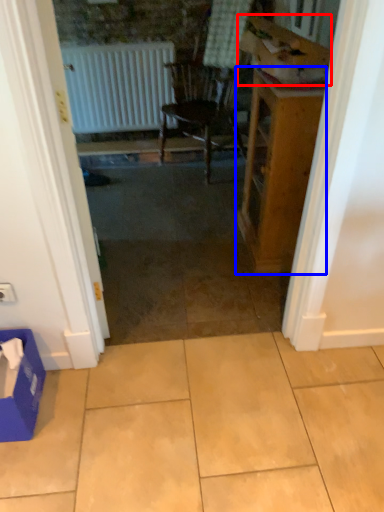
Question: Among these objects, which one is nearest to the camera, cardboard box (highlighted by a red box) or table (highlighted by a blue box)?

Choices:
 (A) cardboard box
 (B) table

Answer: (A)